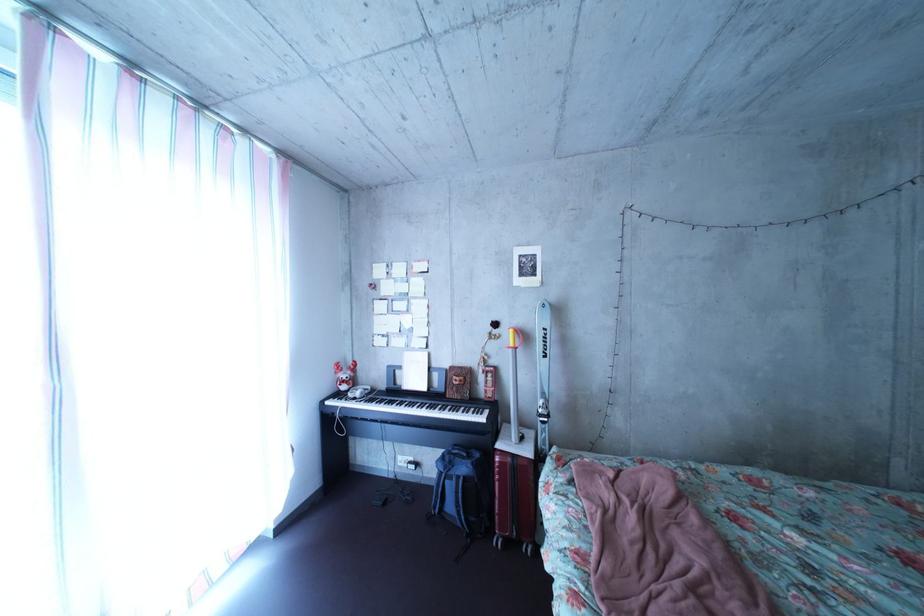
Locate an element on the screen. This screenshot has width=924, height=616. piano keyboard is located at coordinates (441, 413).